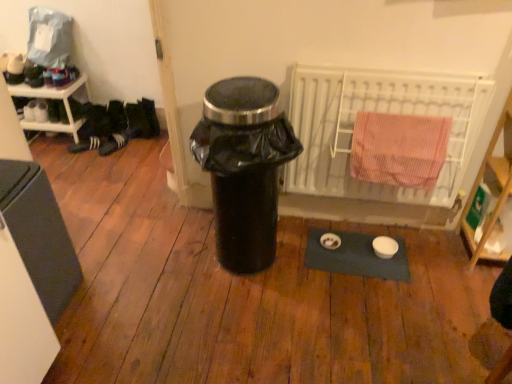
What are the coordinates of `unoccupied region to the right of black plastic trash can at center` in the screenshot? It's located at coord(322,260).